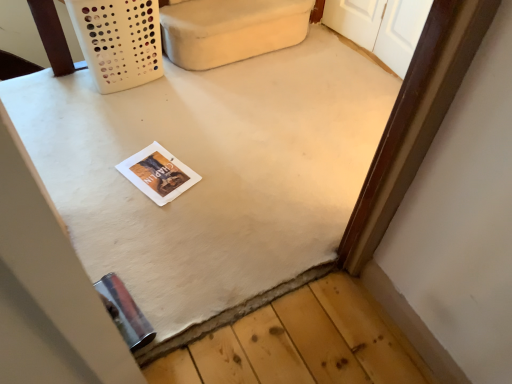
I want to click on free space to the right of white paper magazine at center, so click(x=210, y=174).